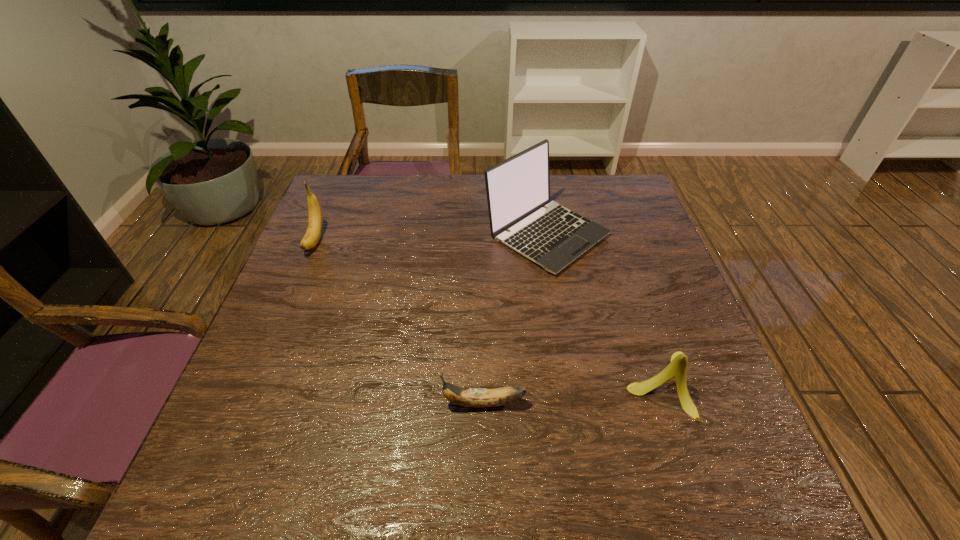
Identify the location of empty location between the second tallest object and the third tallest object. The width and height of the screenshot is (960, 540). (488, 312).

Where is `empty location between the second tallest banana and the laptop_computer`? This screenshot has height=540, width=960. empty location between the second tallest banana and the laptop_computer is located at coordinates (604, 309).

Where is `free point between the tallest banana and the tallest object`? The height and width of the screenshot is (540, 960). free point between the tallest banana and the tallest object is located at coordinates (431, 237).

Find the location of `free spot between the leftmost object and the rightmost banana`. free spot between the leftmost object and the rightmost banana is located at coordinates (488, 312).

What are the coordinates of `the second closest object to the farthest banana` in the screenshot? It's located at (468, 397).

Locate an element on the screen. Image resolution: width=960 pixels, height=540 pixels. the second closest object to the shortest object is located at coordinates (518, 188).

Locate an element on the screen. This screenshot has width=960, height=540. the closest banana relative to the tallest banana is located at coordinates (468, 397).

Locate an element on the screen. The height and width of the screenshot is (540, 960). banana that is the third closest to the laptop_computer is located at coordinates (315, 221).

Locate an element on the screen. Image resolution: width=960 pixels, height=540 pixels. free spot that satisfies the following two spatial constraints: 1. on the front side of the second shortest object; 2. on the peel of the second banana from left to right is located at coordinates (667, 403).

You are a GUI agent. You are given a task and a screenshot of the screen. Output one action in this format:
    pyautogui.click(x=<x>, y=<y>)
    Task: Click on the free spot that satisfies the following two spatial constraints: 1. at the front screen of the laptop_computer; 2. on the right side of the rightmost banana
    
    Given the screenshot: What is the action you would take?
    pyautogui.click(x=573, y=385)